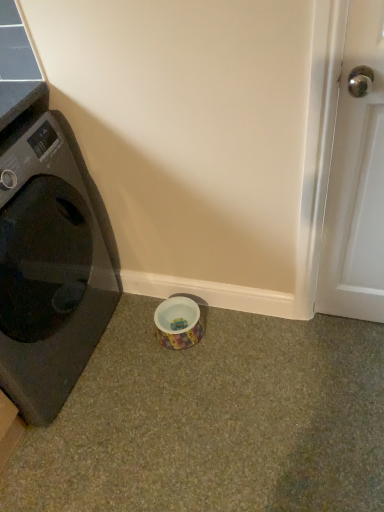
Where is `multicolored ceramic bowl at lower center`? This screenshot has height=512, width=384. multicolored ceramic bowl at lower center is located at coordinates (179, 323).

The height and width of the screenshot is (512, 384). Find the location of `multicolored ceramic bowl at lower center`. multicolored ceramic bowl at lower center is located at coordinates (179, 323).

Which is in front, point (381, 241) or point (65, 352)?

The point (381, 241) is more forward.

Is white glossy door handle at right touching black glossy washing machine at left?

They are not placed beside each other.

Does white glossy door handle at right have a larger size compared to black glossy washing machine at left?

→ Incorrect, white glossy door handle at right is not larger than black glossy washing machine at left.

Which object is closer to the camera taking this photo, white glossy door handle at right or black glossy washing machine at left?

white glossy door handle at right.

Could white glossy door handle at right be considered to be inside multicolored ceramic bowl at lower center?

No, white glossy door handle at right is located outside of multicolored ceramic bowl at lower center.

From the image's perspective, which is below, multicolored ceramic bowl at lower center or white glossy door handle at right?

multicolored ceramic bowl at lower center, from the image's perspective.

In the scene shown: Considering the relative sizes of multicolored ceramic bowl at lower center and white glossy door handle at right in the image provided, is multicolored ceramic bowl at lower center shorter than white glossy door handle at right?

Indeed, multicolored ceramic bowl at lower center has a lesser height compared to white glossy door handle at right.

Which is in front, point (159, 314) or point (340, 314)?

The point (340, 314) is in front.

Looking at this image, what's the angular difference between multicolored ceramic bowl at lower center and black glossy washing machine at left's facing directions?

There is a 90-degree angle between the facing directions of multicolored ceramic bowl at lower center and black glossy washing machine at left.

From the image's perspective, which object appears higher, multicolored ceramic bowl at lower center or black glossy washing machine at left?

From the image's view, black glossy washing machine at left is above.

Would you say multicolored ceramic bowl at lower center is a long distance from black glossy washing machine at left?

No, there isn't a large distance between multicolored ceramic bowl at lower center and black glossy washing machine at left.

Does black glossy washing machine at left have a lesser height compared to white glossy door handle at right?

Correct, black glossy washing machine at left is not as tall as white glossy door handle at right.

Is black glossy washing machine at left inside the boundaries of white glossy door handle at right, or outside?

black glossy washing machine at left lies outside white glossy door handle at right.

Considering the positions of objects black glossy washing machine at left and white glossy door handle at right in the image provided, who is in front, black glossy washing machine at left or white glossy door handle at right?

white glossy door handle at right.

Locate an element on the screen. This screenshot has height=512, width=384. door in front of the black glossy washing machine at left is located at coordinates (356, 180).

Which is closer to the camera, [328,201] or [195,305]?

Point [328,201] is closer to the camera than point [195,305].

Considering the sizes of white glossy door handle at right and multicolored ceramic bowl at lower center in the image, is white glossy door handle at right taller or shorter than multicolored ceramic bowl at lower center?

Clearly, white glossy door handle at right is taller compared to multicolored ceramic bowl at lower center.

You are a GUI agent. You are given a task and a screenshot of the screen. Output one action in this format:
    pyautogui.click(x=<x>, y=<y>)
    Task: Click on the door in front of the multicolored ceramic bowl at lower center
    
    Given the screenshot: What is the action you would take?
    356,180

From the image's perspective, is white glossy door handle at right on multicolored ceramic bowl at lower center?

Correct, white glossy door handle at right appears higher than multicolored ceramic bowl at lower center in the image.

Consider the image. From a real-world perspective, is black glossy washing machine at left physically below multicolored ceramic bowl at lower center?

No, from a real-world perspective, black glossy washing machine at left is not beneath multicolored ceramic bowl at lower center.

Is multicolored ceramic bowl at lower center completely or partially inside black glossy washing machine at left?

No, multicolored ceramic bowl at lower center is not inside black glossy washing machine at left.

Consider the image. In terms of height, does black glossy washing machine at left look taller or shorter compared to multicolored ceramic bowl at lower center?

Clearly, black glossy washing machine at left is taller compared to multicolored ceramic bowl at lower center.

In order to click on door on the right of black glossy washing machine at left in this screenshot , I will do `click(356, 180)`.

This screenshot has width=384, height=512. I want to click on tape behind the white glossy door handle at right, so click(x=179, y=323).

From the image, which object appears to be farther from white glossy door handle at right, black glossy washing machine at left or multicolored ceramic bowl at lower center?

The object further to white glossy door handle at right is black glossy washing machine at left.

Consider the image. Estimate the real-world distances between objects in this image. Which object is further from multicolored ceramic bowl at lower center, black glossy washing machine at left or white glossy door handle at right?

white glossy door handle at right.

Which object lies nearer to the anchor point white glossy door handle at right, multicolored ceramic bowl at lower center or black glossy washing machine at left?

Among the two, multicolored ceramic bowl at lower center is located nearer to white glossy door handle at right.

From the picture: Considering their positions, is white glossy door handle at right positioned closer to black glossy washing machine at left than multicolored ceramic bowl at lower center?

Among the two, multicolored ceramic bowl at lower center is located nearer to black glossy washing machine at left.

Considering their positions, is multicolored ceramic bowl at lower center positioned closer to black glossy washing machine at left than white glossy door handle at right?

multicolored ceramic bowl at lower center.

From the image, which object appears to be farther from multicolored ceramic bowl at lower center, white glossy door handle at right or black glossy washing machine at left?

white glossy door handle at right lies further to multicolored ceramic bowl at lower center than the other object.

Where is `tape between black glossy washing machine at left and white glossy door handle at right in the horizontal direction`? tape between black glossy washing machine at left and white glossy door handle at right in the horizontal direction is located at coordinates (179, 323).